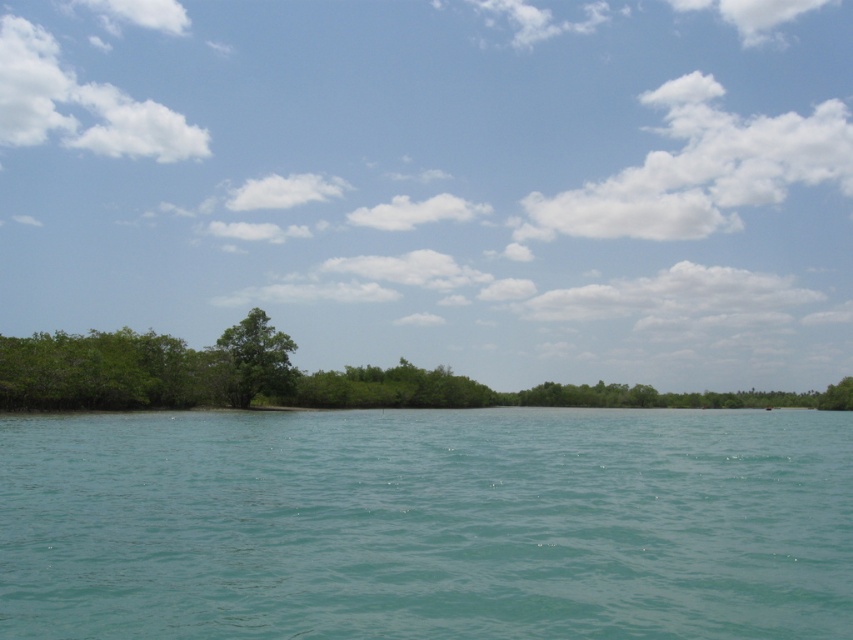
You are a bird flying over the scene and want to land on the highest point between the teal water at center and the green leafy tree at center. Which one should you choose?

The green leafy tree at center is taller than the teal water at center, so you should choose the green leafy tree at center to land on the highest point.

You are standing at the center of the image and want to locate the teal water at center. According to the coordinates provided, in which direction should you look to find it?

The teal water at center is located at coordinates point (426, 524), so you should look slightly to the right from the center point since the x coordinate 0.819 is greater than 0.5.